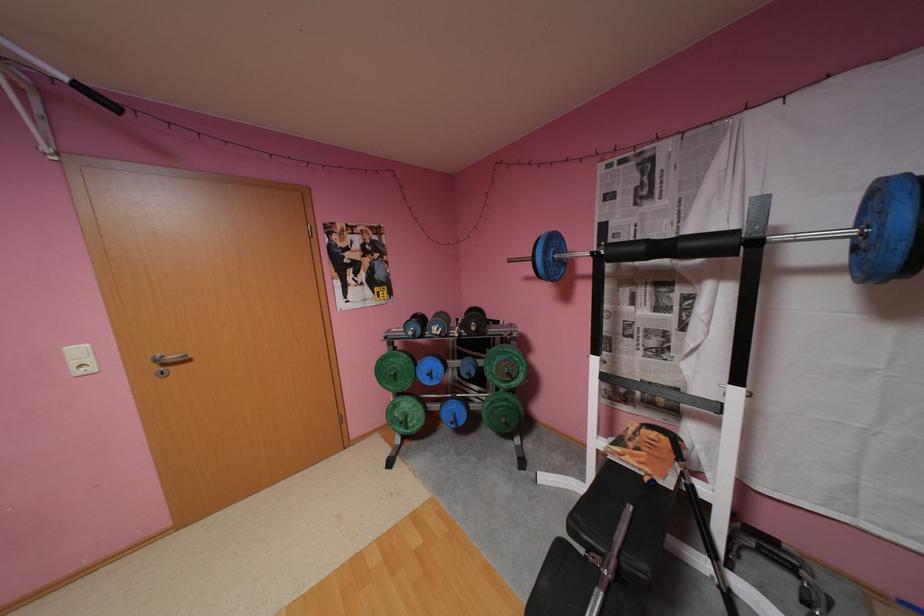
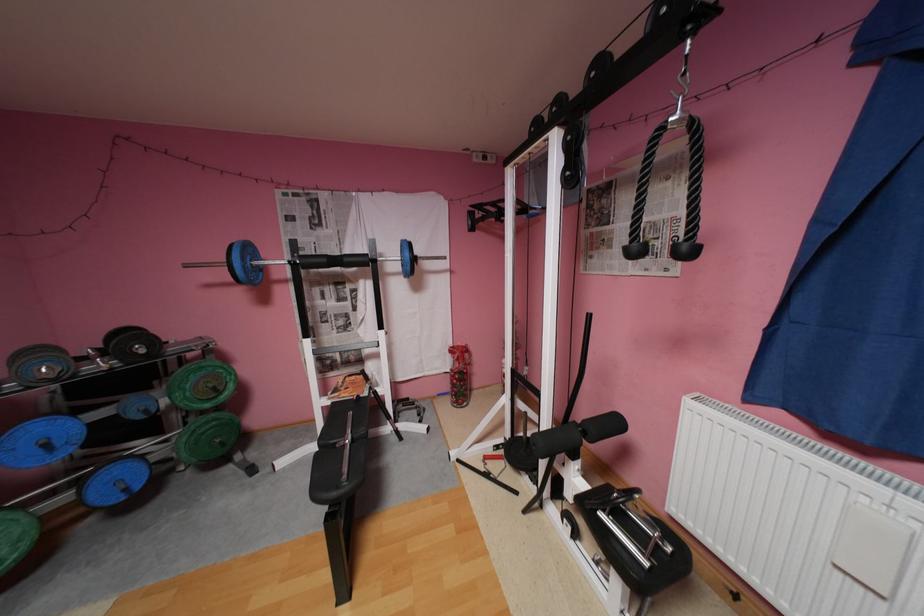
In the second image, find the point that corresponds to [691,245] in the first image.

(355, 259)